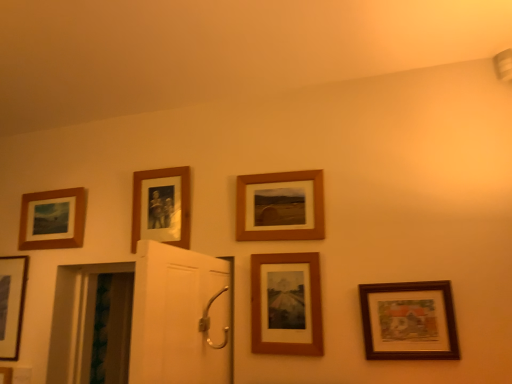
Question: Would you say wooden picture frame at lower right, positioned as the sixth picture frame in left-to-right order, is inside or outside wooden photo frame at upper center, arranged as the 4th picture frame when viewed from the right?

Choices:
 (A) outside
 (B) inside

Answer: (A)

Question: Based on their positions, is wooden picture frame at lower right, acting as the 1th picture frame starting from the right, located to the left or right of wooden photo frame at upper center, which ranks as the third picture frame in left-to-right order?

Choices:
 (A) left
 (B) right

Answer: (B)

Question: Which object is the farthest from the wooden photo frame at upper center, which ranks as the third picture frame in left-to-right order?

Choices:
 (A) matte wood picture frame at upper left, which is counted as the fifth picture frame, starting from the right
 (B) matte black picture frame at lower left, the 1th picture frame from the left
 (C) wooden frame at center, the fourth picture frame in the left-to-right sequence
 (D) wooden picture frame at lower right, acting as the 1th picture frame starting from the right
 (E) wooden framed print at center, which is the 5th picture frame in left-to-right order

Answer: (D)

Question: Estimate the real-world distances between objects in this image. Which object is closer to the wooden framed print at center, which is the 5th picture frame in left-to-right order?

Choices:
 (A) matte black picture frame at lower left, the 6th picture frame positioned from the right
 (B) wooden picture frame at lower right, positioned as the sixth picture frame in left-to-right order
 (C) matte wood picture frame at upper left, which is counted as the fifth picture frame, starting from the right
 (D) wooden frame at center, the fourth picture frame in the left-to-right sequence
 (E) wooden photo frame at upper center, which ranks as the third picture frame in left-to-right order

Answer: (D)